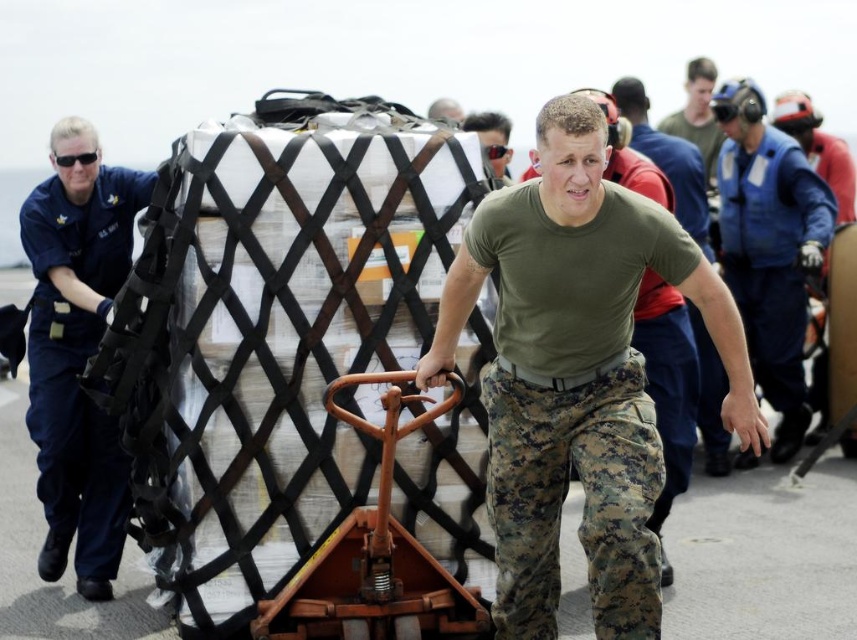
Question: Estimate the real-world distances between objects in this image. Which object is closer to the blue uniform at left?

Choices:
 (A) blue uniform at center
 (B) green matte t-shirt at center
 (C) blue fabric jacket at upper right

Answer: (B)

Question: Is green matte t-shirt at center further to the viewer compared to matte black sunglasses at center?

Choices:
 (A) yes
 (B) no

Answer: (A)

Question: Does blue fabric jacket at upper right have a larger size compared to green matte t-shirt at center?

Choices:
 (A) yes
 (B) no

Answer: (B)

Question: Which object is closer to the camera taking this photo?

Choices:
 (A) blue uniform at center
 (B) blue fabric jacket at upper right
 (C) matte black sunglasses at center

Answer: (C)

Question: Estimate the real-world distances between objects in this image. Which object is farther from the matte black sunglasses at center?

Choices:
 (A) green camo pants at center
 (B) green matte t-shirt at center
 (C) blue uniform at center

Answer: (C)

Question: Is blue uniform at center thinner than matte black sunglasses at center?

Choices:
 (A) no
 (B) yes

Answer: (A)